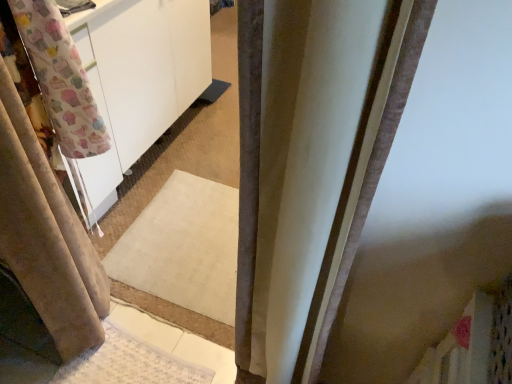
Question: Considering the positions of point (53, 205) and point (260, 72), is point (53, 205) closer or farther from the camera than point (260, 72)?

Choices:
 (A) closer
 (B) farther

Answer: (B)

Question: Considering their positions, is beige fabric curtain at left, arranged as the 1th curtain when viewed from the left, located in front of or behind satin beige curtain at center, the first curtain viewed from the right?

Choices:
 (A) behind
 (B) front

Answer: (A)

Question: From a real-world perspective, is beige fabric curtain at left, arranged as the 1th curtain when viewed from the left, positioned above or below satin beige curtain at center, which is counted as the second curtain, starting from the left?

Choices:
 (A) above
 (B) below

Answer: (B)

Question: Do you think satin beige curtain at center, the first curtain viewed from the right, is within beige fabric curtain at left, which ranks as the 2th curtain in right-to-left order, or outside of it?

Choices:
 (A) outside
 (B) inside

Answer: (A)

Question: From a real-world perspective, is satin beige curtain at center, which is counted as the second curtain, starting from the left, above or below beige fabric curtain at left, arranged as the 1th curtain when viewed from the left?

Choices:
 (A) below
 (B) above

Answer: (B)

Question: Does point (297, 264) appear closer or farther from the camera than point (24, 125)?

Choices:
 (A) closer
 (B) farther

Answer: (A)

Question: From the image's perspective, is satin beige curtain at center, the first curtain viewed from the right, located above or below beige fabric curtain at left, which ranks as the 2th curtain in right-to-left order?

Choices:
 (A) below
 (B) above

Answer: (B)